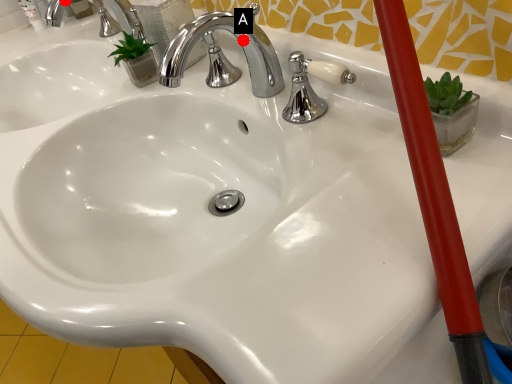
Question: Two points are circled on the image, labeled by A and B beside each circle. Among these points, which one is nearest to the camera?

Choices:
 (A) A is closer
 (B) B is closer

Answer: (A)